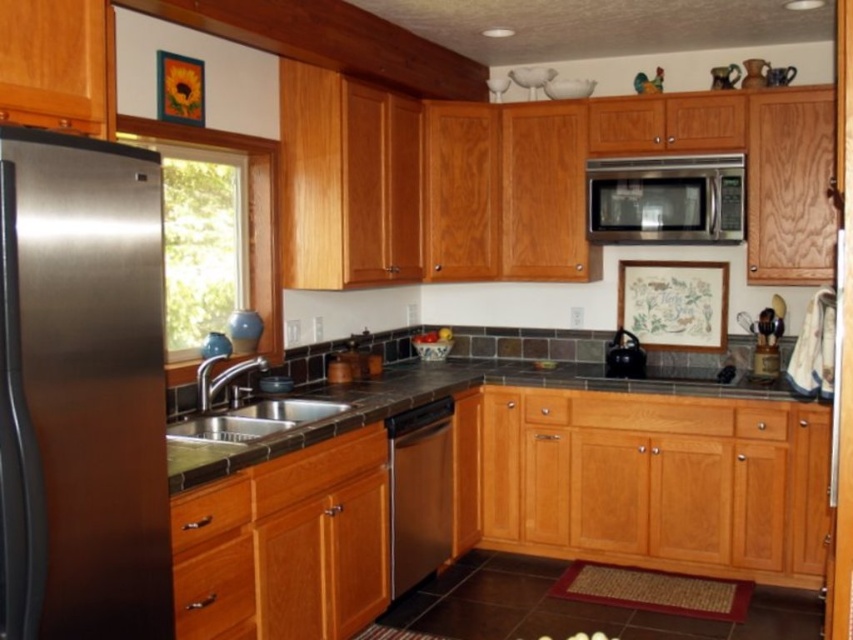
You are a delivery person who just arrived with a new microwave. The current microwave is the satin silver microwave at upper center. The new microwave is 1.6 meters wide. Can you replace the current microwave with the new one without moving the stainless steel dishwasher at center?

The satin silver microwave at upper center is 1.58 meters away from the stainless steel dishwasher at center. Since the new microwave is 1.6 meters wide, which is slightly wider than the distance between them, it would not fit without moving the dishwasher.

You are a chef preparing to place a hot dish on the dark gray granite countertop at center and the satin silver microwave at upper center. Which surface is more to the left?

The dark gray granite countertop at center is positioned on the left side of the satin silver microwave at upper center, so it is more to the left.

You are standing in the kitchen and want to place a cutting board on the dark gray granite countertop at center. However, there is a satin silver microwave at upper center above it. Is the countertop within reach to place the board without needing to climb?

The dark gray granite countertop at center is closer to the viewer than the satin silver microwave at upper center, so yes, the countertop is within reach to place the cutting board without needing to climb.